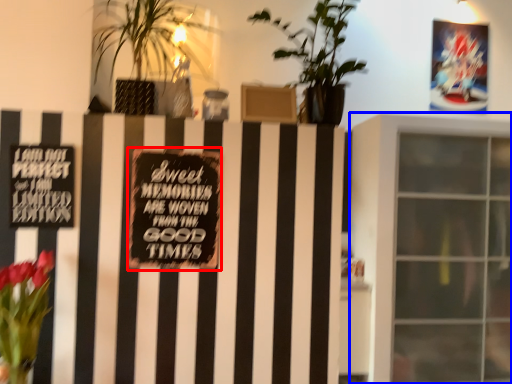
Question: Which point is closer to the camera, plaque (highlighted by a red box) or window (highlighted by a blue box)?

Choices:
 (A) plaque
 (B) window

Answer: (A)